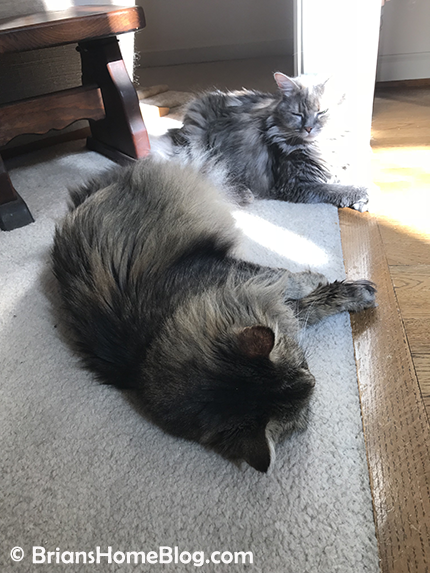
The height and width of the screenshot is (573, 430). Find the location of `entryway out of room`. entryway out of room is located at coordinates (416, 125), (202, 88).